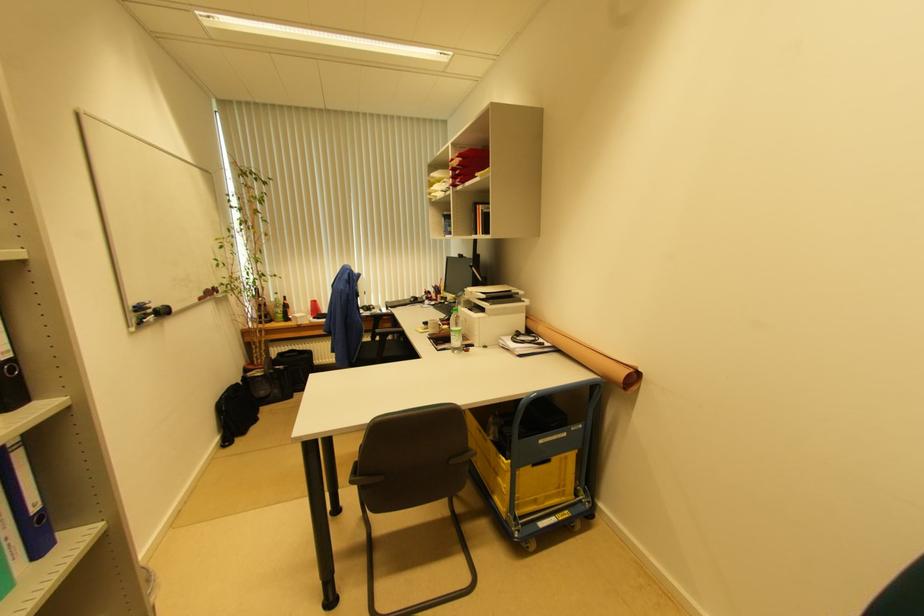
Find where to lift the yellow plastic crate. Please return your answer as a coordinate pair (x, y).

(525, 477)